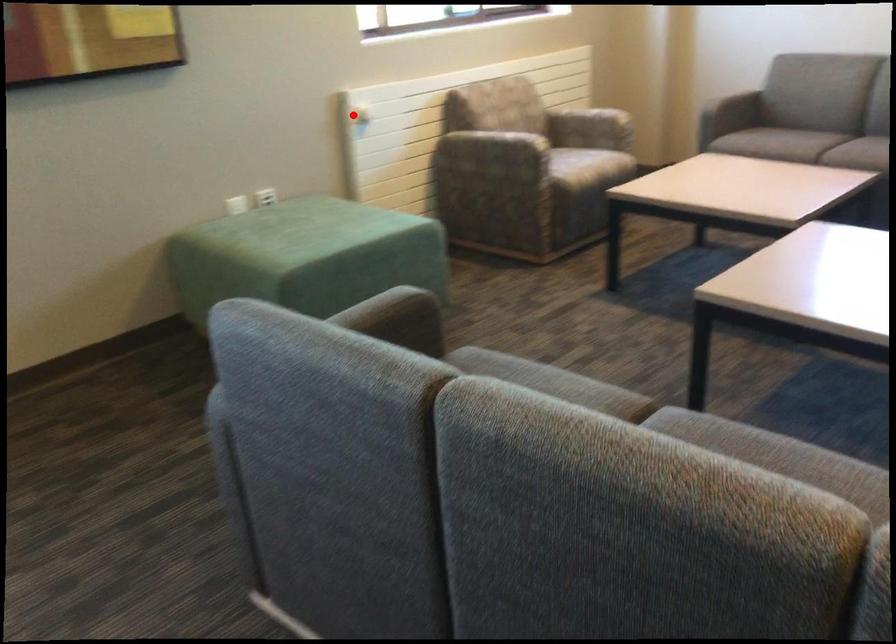
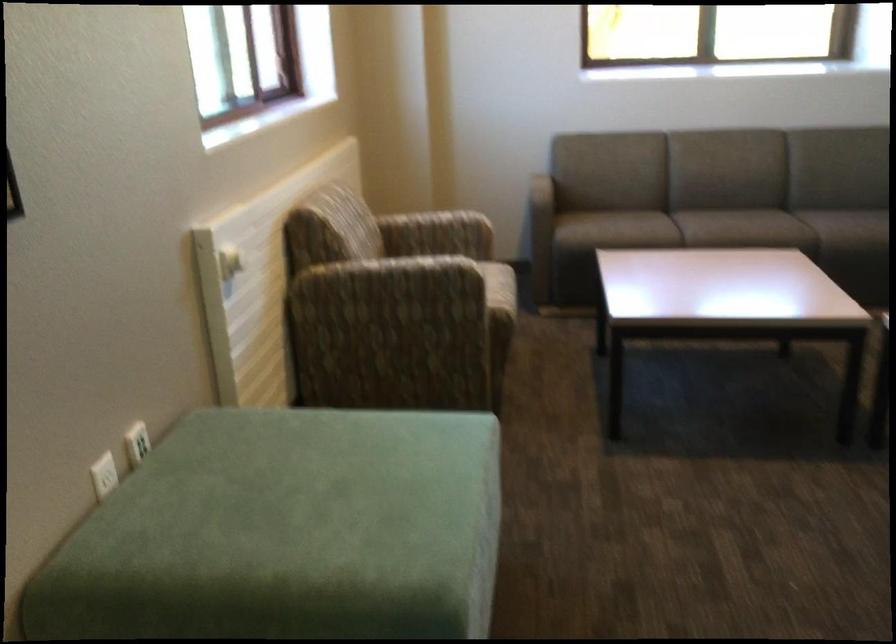
Question: I am providing you with two images of the same scene from different viewpoints. Image1 has a red point marked. In image2, the corresponding 3D location appears at what relative position? Reply with the corresponding letter.

Choices:
 (A) Closer
 (B) Farther

Answer: (A)